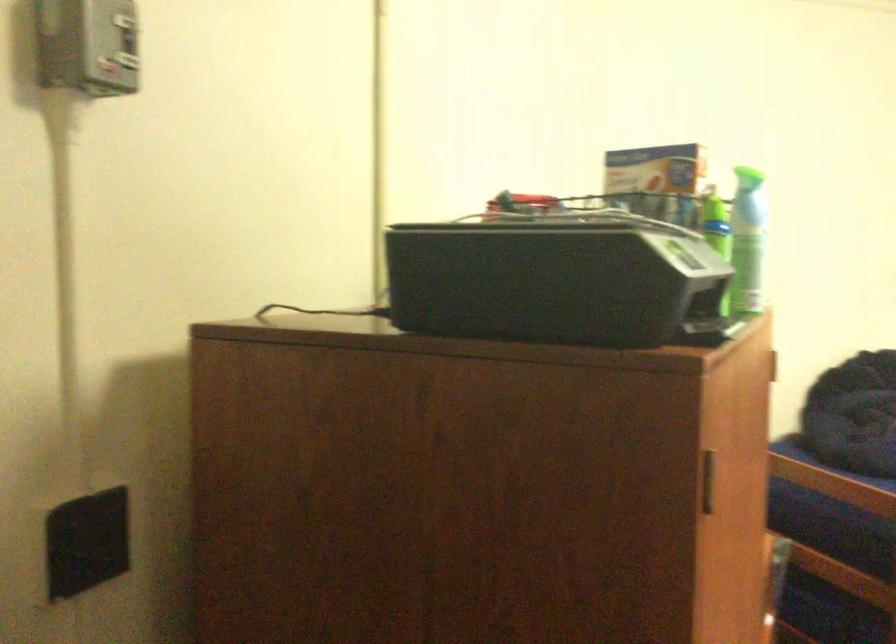
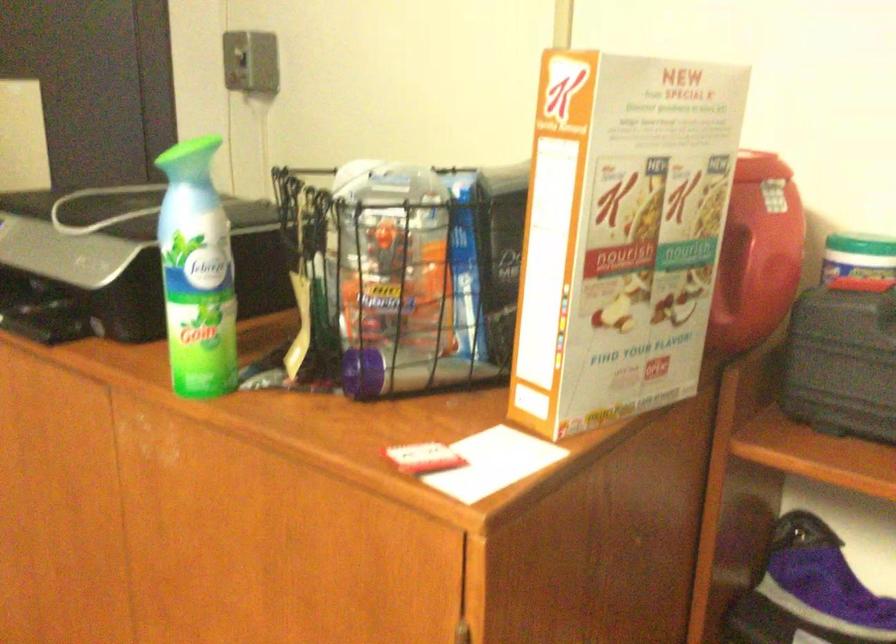
Find the pixel in the second image that matches the point at 648,196 in the first image.

(640, 228)